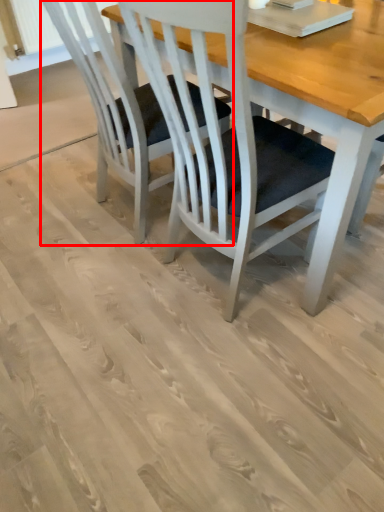
Question: From the image's perspective, considering the relative positions of chair (annotated by the red box) and table in the image provided, where is chair (annotated by the red box) located with respect to the staircase?

Choices:
 (A) below
 (B) above

Answer: (B)